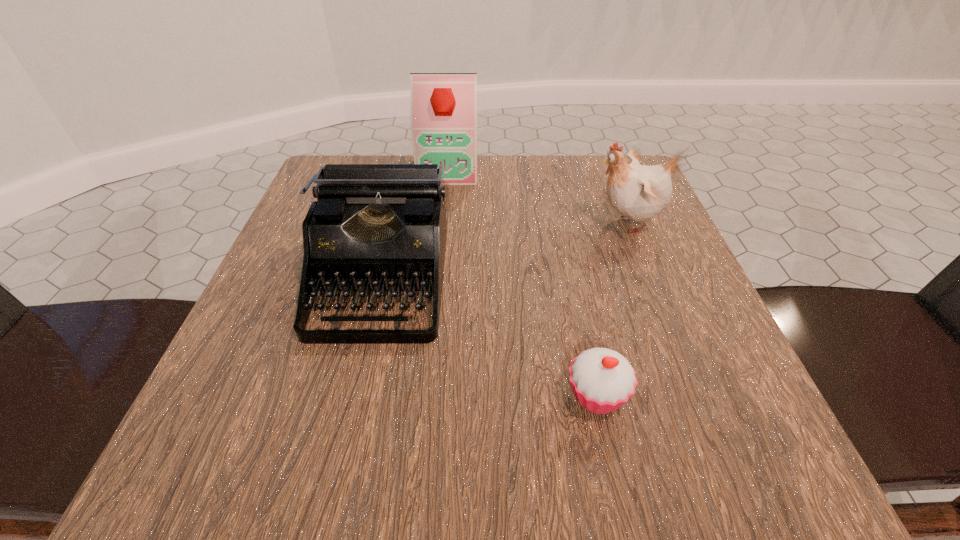
What are the coordinates of `free space that satisfies the following two spatial constraints: 1. at the beak of the rightmost object; 2. on the front side of the shortest object` in the screenshot? It's located at (695, 395).

You are a GUI agent. You are given a task and a screenshot of the screen. Output one action in this format:
    pyautogui.click(x=<x>, y=<y>)
    Task: Click on the vacant area that satisfies the following two spatial constraints: 1. on the typing side of the shortest object; 2. on the right side of the third tallest object
    The height and width of the screenshot is (540, 960).
    Given the screenshot: What is the action you would take?
    pyautogui.click(x=351, y=395)